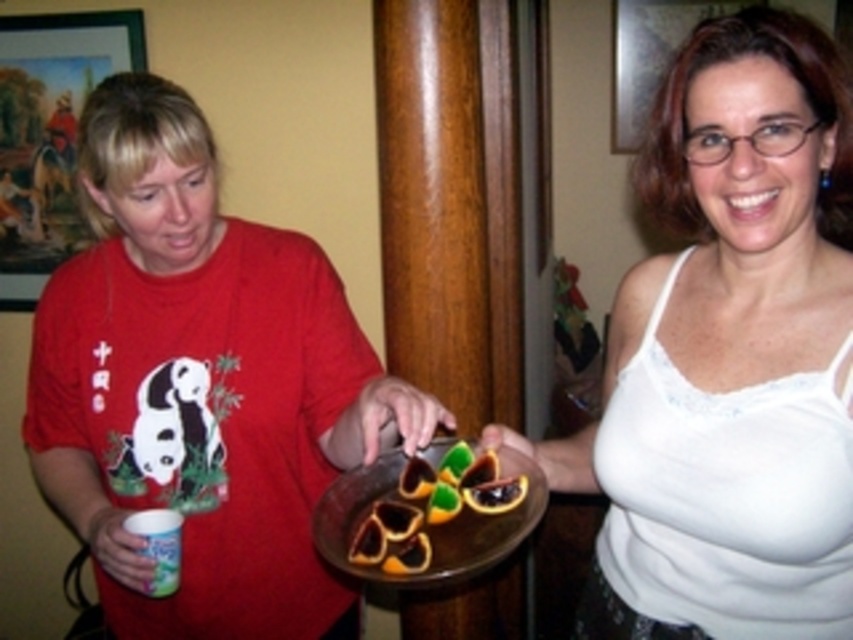
Which is below, matte red shirt at left or semi-glossy orange slices at center?

semi-glossy orange slices at center is below.

Which is above, matte red shirt at left or semi-glossy orange slices at center?

matte red shirt at left

Where is `matte red shirt at left`? Image resolution: width=853 pixels, height=640 pixels. matte red shirt at left is located at coordinates (200, 385).

This screenshot has width=853, height=640. I want to click on matte red shirt at left, so click(x=200, y=385).

Based on the photo, does matte red shirt at left appear on the right side of white fabric tank top at center?

Incorrect, matte red shirt at left is not on the right side of white fabric tank top at center.

Is the position of matte red shirt at left more distant than that of white fabric tank top at center?

Yes, it is.

Identify the location of matte red shirt at left. (200, 385).

Is white fabric tank top at center thinner than semi-glossy orange slices at center?

Incorrect, white fabric tank top at center's width is not less than semi-glossy orange slices at center's.

Can you confirm if white fabric tank top at center is shorter than semi-glossy orange slices at center?

No, white fabric tank top at center is not shorter than semi-glossy orange slices at center.

Describe the element at coordinates (721, 337) in the screenshot. The image size is (853, 640). I see `white fabric tank top at center` at that location.

I want to click on white fabric tank top at center, so click(721, 337).